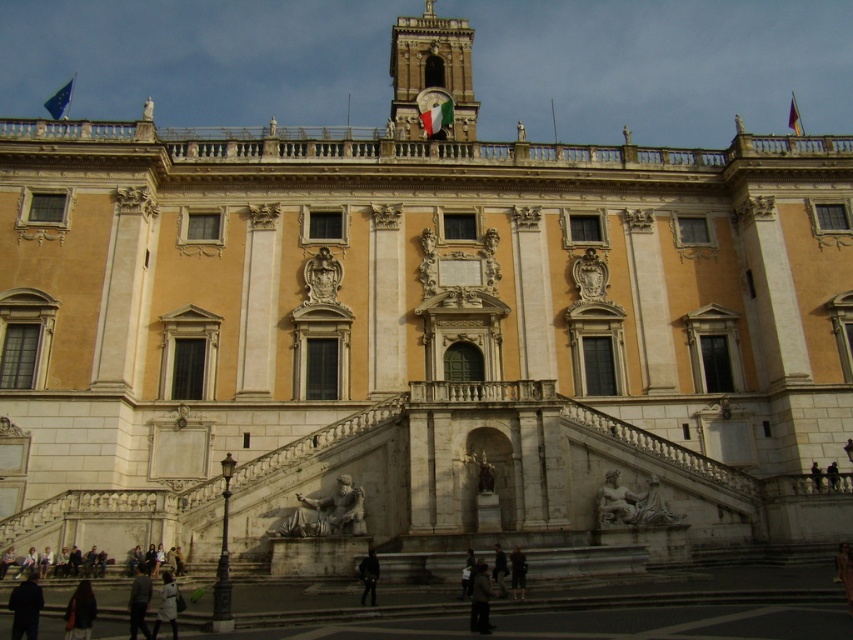
Does dark gray fabric jacket at lower center appear under dark gray stone statue at center?

Yes.

Between point (463, 577) and point (816, 472), which one is positioned in front?

Point (463, 577)

Find the location of a particular element. dark gray fabric jacket at lower center is located at coordinates (467, 573).

Is dark brown leather jacket at lower left below dark gray fabric jacket at lower left?

No, dark brown leather jacket at lower left is not below dark gray fabric jacket at lower left.

Is point (83, 627) closer to camera compared to point (131, 593)?

Yes, point (83, 627) is in front of point (131, 593).

Locate an element on the screen. This screenshot has height=640, width=853. dark brown leather jacket at lower left is located at coordinates (80, 611).

Is dark gray jacket at lower left thinner than matte stone statue at lower right?

No, dark gray jacket at lower left is not thinner than matte stone statue at lower right.

Is dark gray jacket at lower left smaller than matte stone statue at lower right?

Actually, dark gray jacket at lower left might be larger than matte stone statue at lower right.

Is point (19, 632) farther from viewer compared to point (653, 500)?

No, (19, 632) is closer to viewer.

Identify the location of dark gray jacket at lower left. (25, 608).